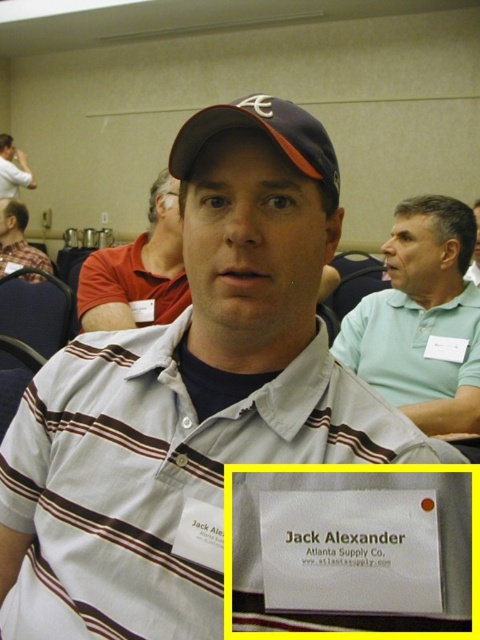
Can you confirm if light green polo shirt at right is positioned above matte black cap at upper center?

Actually, light green polo shirt at right is below matte black cap at upper center.

Who is more distant from viewer, (x=360, y=305) or (x=19, y=161)?

Point (x=19, y=161)

This screenshot has width=480, height=640. What are the coordinates of `light green polo shirt at right` in the screenshot? It's located at (421, 320).

Does light green polo shirt at right have a greater width compared to matte black baseball cap at upper center?

Correct, the width of light green polo shirt at right exceeds that of matte black baseball cap at upper center.

Can you confirm if light green polo shirt at right is taller than matte black baseball cap at upper center?

Yes.

Where is `light green polo shirt at right`? The image size is (480, 640). light green polo shirt at right is located at coordinates (421, 320).

This screenshot has width=480, height=640. Identify the location of light green polo shirt at right. 421,320.

Does matte black baseball cap at upper center appear on the right side of gray striped shirt at center?

Incorrect, matte black baseball cap at upper center is not on the right side of gray striped shirt at center.

Does matte black baseball cap at upper center have a lesser height compared to gray striped shirt at center?

Indeed, matte black baseball cap at upper center has a lesser height compared to gray striped shirt at center.

Is point (331, 150) positioned after point (468, 273)?

That is False.

Where is `matte black baseball cap at upper center`? matte black baseball cap at upper center is located at coordinates (265, 134).